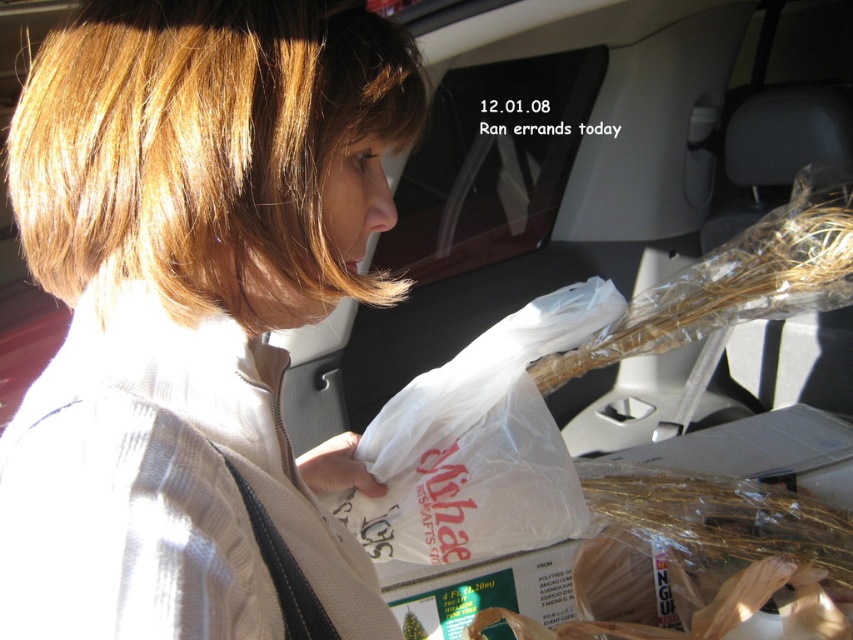
Question: Which object is closer to the camera taking this photo?

Choices:
 (A) white plastic grocery bag at center
 (B) light brown hair at upper left

Answer: (B)

Question: Which point is closer to the camera taking this photo?

Choices:
 (A) (155, 138)
 (B) (432, 413)

Answer: (A)

Question: Can you confirm if light brown hair at upper left is positioned to the right of white plastic grocery bag at center?

Choices:
 (A) yes
 (B) no

Answer: (B)

Question: Can you confirm if light brown hair at upper left is wider than white plastic grocery bag at center?

Choices:
 (A) no
 (B) yes

Answer: (A)

Question: Is light brown hair at upper left wider than white plastic grocery bag at center?

Choices:
 (A) yes
 (B) no

Answer: (B)